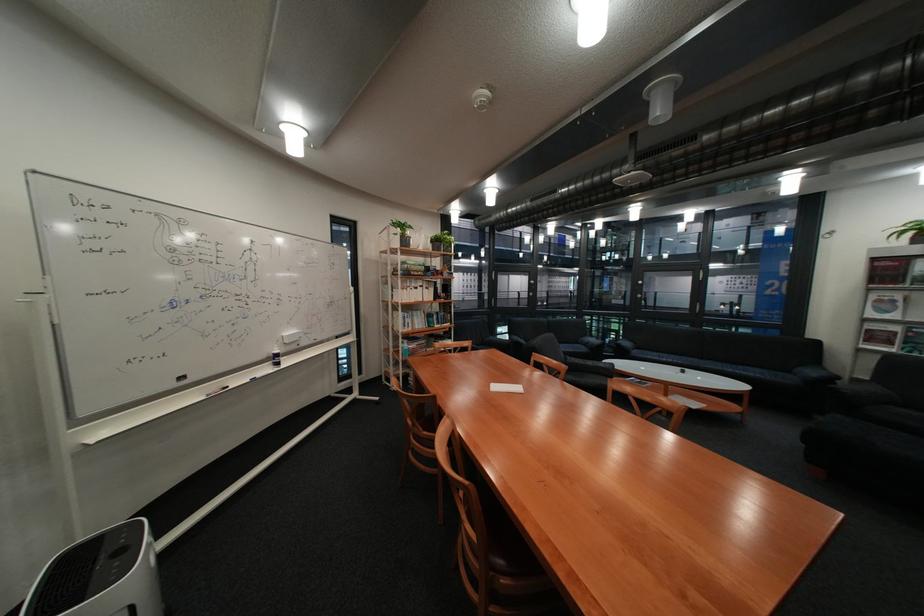
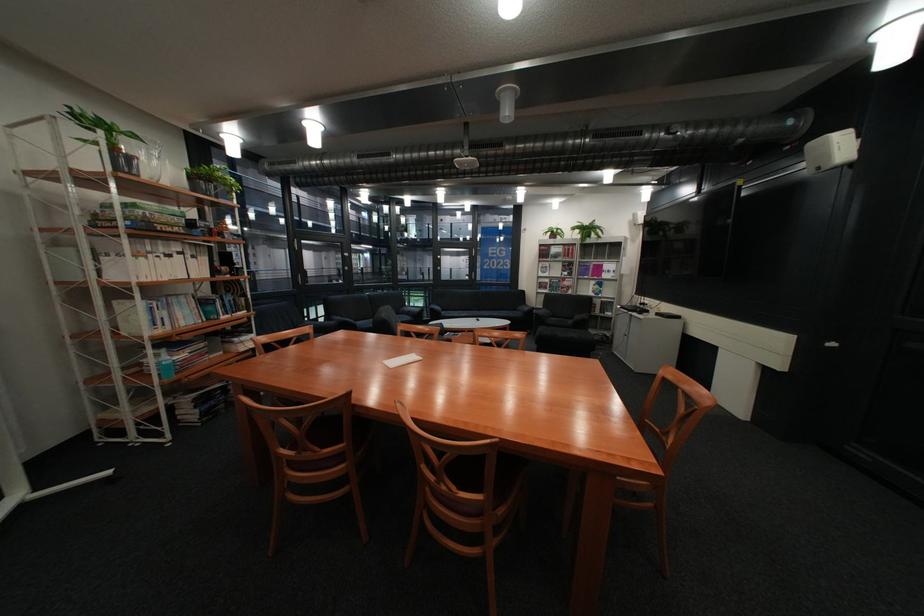
Find the pixel in the second image that matches (x=424, y=246) in the first image.

(152, 177)